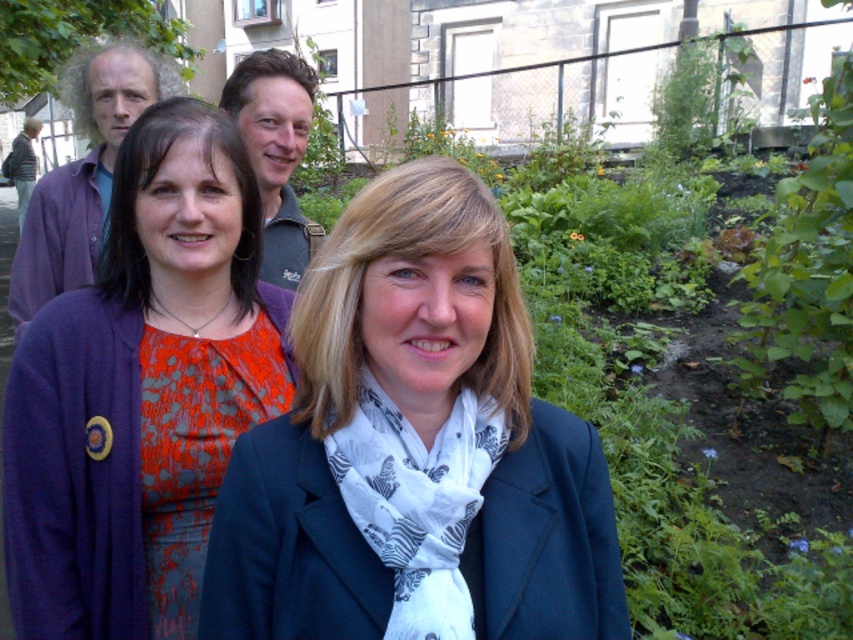
You are a photographer trying to capture a group photo of the matte purple shirt at upper left and the green textured shirt at center. Based on their heights, which one should you position closer to the camera to ensure both are fully visible in the frame?

The matte purple shirt at upper left is taller than the green textured shirt at center, so you should position the matte purple shirt at upper left closer to the camera to ensure both are fully visible in the frame.